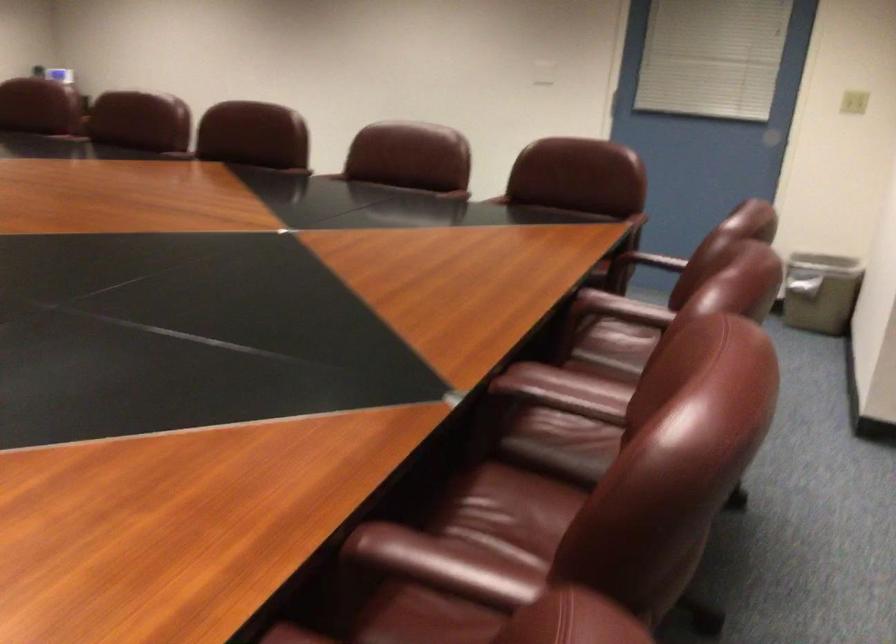
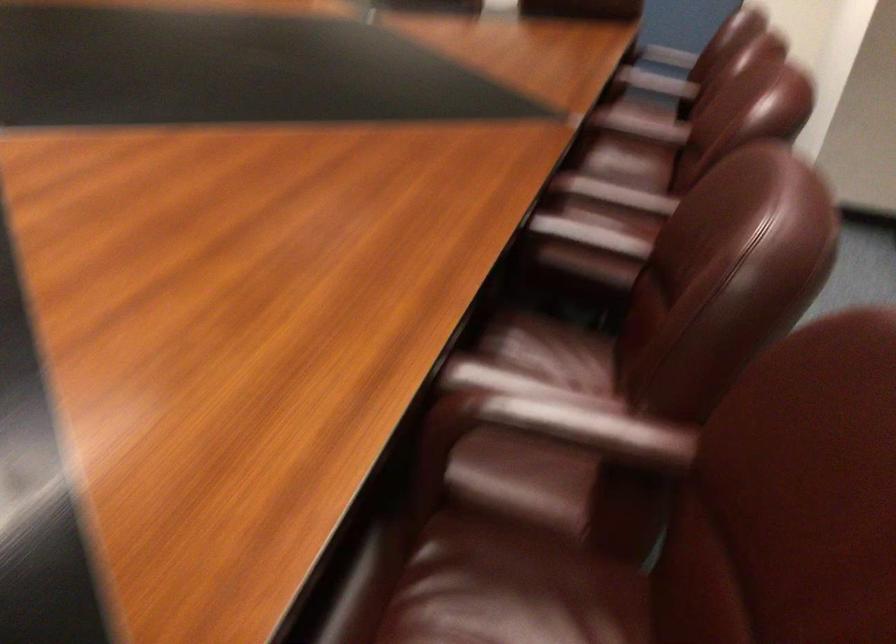
What movement of the cameraman would produce the second image?

The cameraman walked toward left, backward.